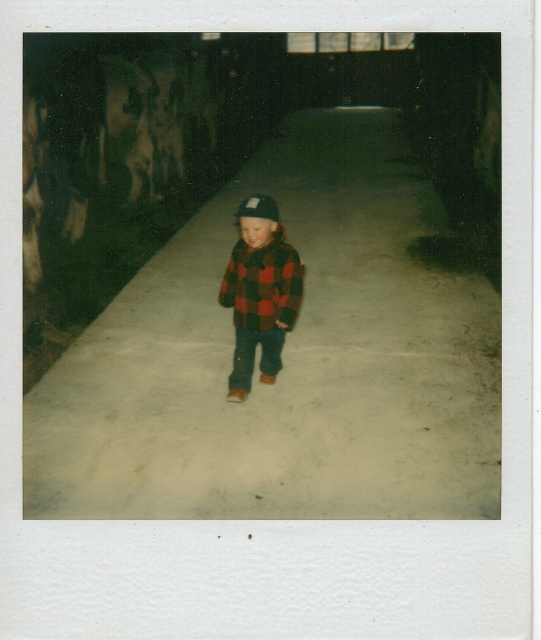
Question: Which of the following is the closest to the observer?

Choices:
 (A) plaid wool jacket at center
 (B) black felt hat at center

Answer: (B)

Question: Which of the following is the closest to the observer?

Choices:
 (A) flannel plaid jacket at center
 (B) plaid wool jacket at center
 (C) white concrete pavement at center

Answer: (C)

Question: Which point is closer to the camera?

Choices:
 (A) (268, 288)
 (B) (229, 381)

Answer: (A)

Question: From the image, what is the correct spatial relationship of white concrete pavement at center in relation to black felt hat at center?

Choices:
 (A) below
 (B) above

Answer: (B)

Question: Is white concrete pavement at center thinner than black felt hat at center?

Choices:
 (A) no
 (B) yes

Answer: (A)

Question: Observing the image, what is the correct spatial positioning of white concrete pavement at center in reference to flannel plaid jacket at center?

Choices:
 (A) left
 (B) right

Answer: (B)